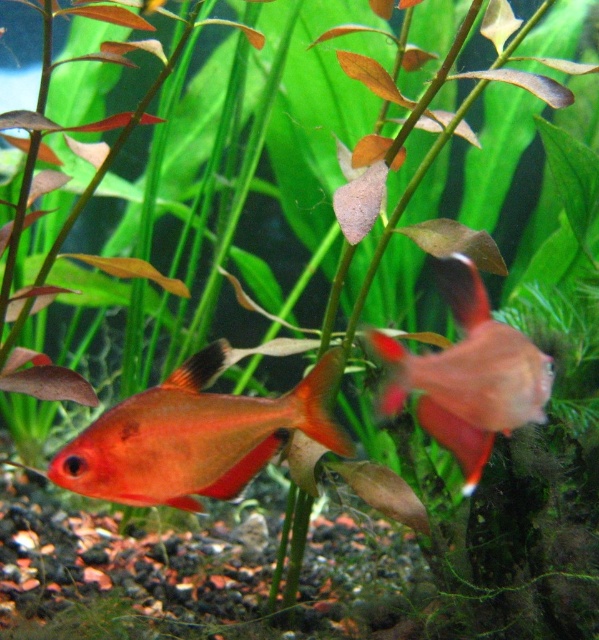
Question: Considering the relative positions of shiny orange fish at center and glossy red fish at center in the image provided, where is shiny orange fish at center located with respect to glossy red fish at center?

Choices:
 (A) left
 (B) right

Answer: (A)

Question: Does shiny orange fish at center appear on the left side of glossy red fish at center?

Choices:
 (A) no
 (B) yes

Answer: (B)

Question: Is shiny orange fish at center bigger than glossy red fish at center?

Choices:
 (A) yes
 (B) no

Answer: (B)